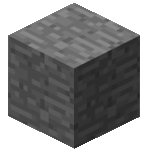
The image size is (150, 150). In order to click on corners in this screenshot , I will do `click(8, 116)`, `click(8, 35)`, `click(73, 2)`, `click(73, 68)`, `click(139, 36)`, `click(139, 117)`, `click(74, 148)`.